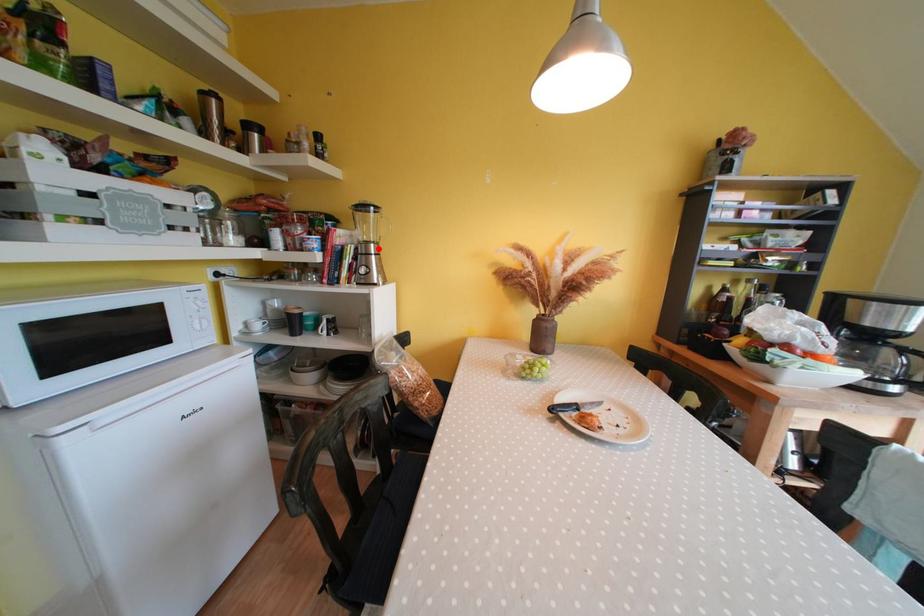
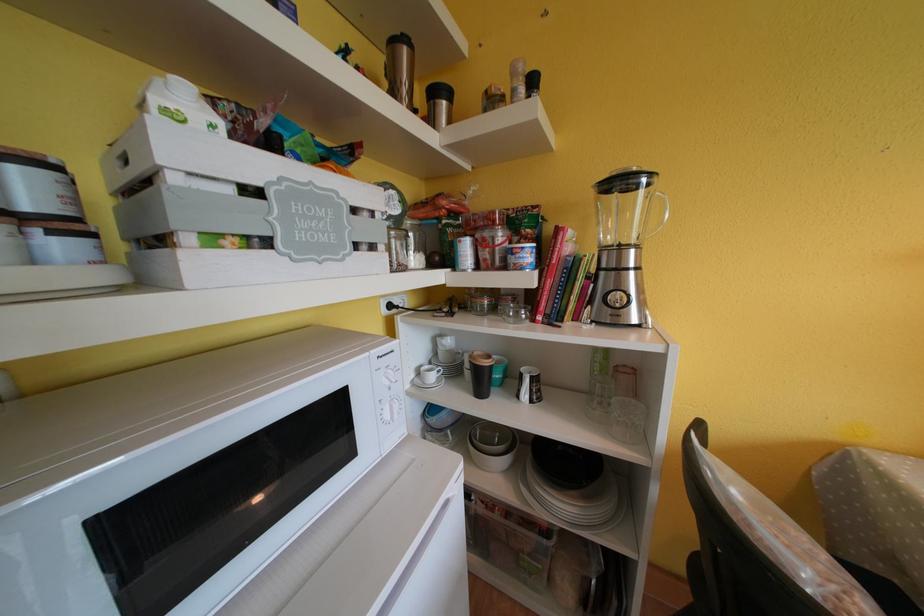
Locate, in the second image, the point that corresponds to the highlighted location in the first image.

(638, 254)